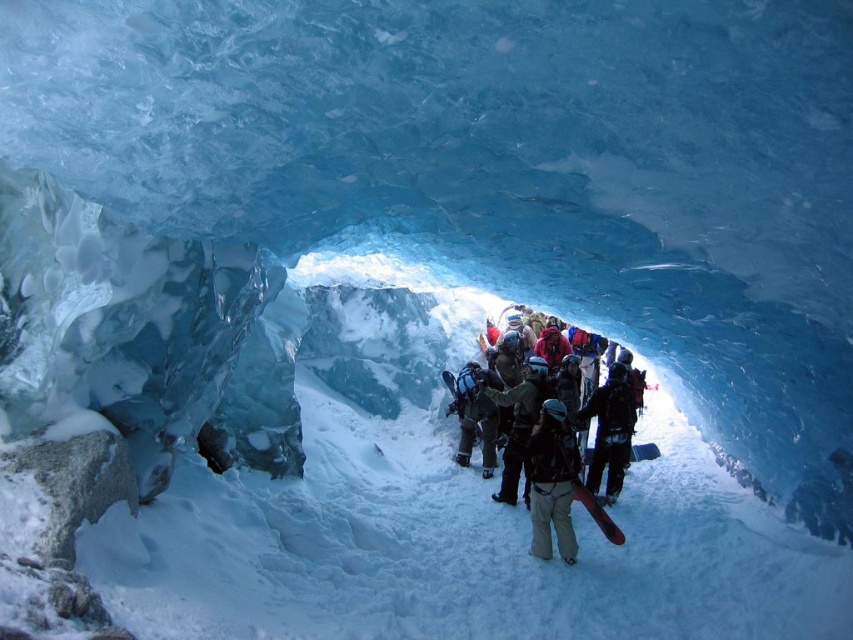
You are a photographer standing at the entrance of the ice cave and want to take a photo of the matte black jacket at center and the dark brown leather jacket at center. Which jacket will appear bigger in the photo?

The matte black jacket at center will appear bigger in the photo because it has a larger size compared to the dark brown leather jacket at center.

You are part of the group exploring the ice cave and need to determine which jacket is taller between the matte black jacket at center and the dark brown leather jacket at center. Which one is taller?

The matte black jacket at center is taller than the dark brown leather jacket at center according to the description.